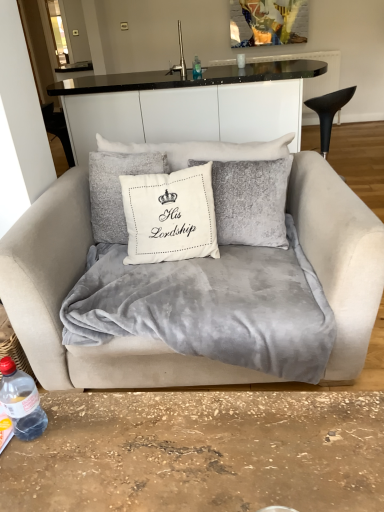
Where is `silver metallic faucet at upper center`? The image size is (384, 512). silver metallic faucet at upper center is located at coordinates tap(180, 58).

What do you see at coordinates (65, 295) in the screenshot? I see `velvet beige couch at center` at bounding box center [65, 295].

Locate an element on the screen. This screenshot has width=384, height=512. velvet beige couch at center is located at coordinates (65, 295).

Image resolution: width=384 pixels, height=512 pixels. What do you see at coordinates (241, 60) in the screenshot?
I see `white ceramic cup at upper center` at bounding box center [241, 60].

Identify the location of velvet gray blanket at center. (211, 306).

The image size is (384, 512). In order to click on transparent plastic bottle at lower left, the first bottle viewed from the left in this screenshot , I will do `click(21, 401)`.

In order to face transparent plastic bottle at lower left, the 2th bottle from the right, should I rotate leftwards or rightwards?

To face it directly, rotate left by 22.317 degrees.

Locate an element on the screen. This screenshot has width=384, height=512. transparent plastic bottle at center, arranged as the 1th bottle when viewed from the back is located at coordinates (197, 68).

Is velvet gray blanket at center facing towards white ceramic cup at upper center?

No, velvet gray blanket at center is not turned towards white ceramic cup at upper center.

Between velvet gray blanket at center and white ceramic cup at upper center, which one appears on the right side from the viewer's perspective?

Positioned to the right is white ceramic cup at upper center.

Would you say white ceramic cup at upper center is part of velvet gray blanket at center's contents?

No.

What's the angular difference between velvet gray blanket at center and white ceramic cup at upper center's facing directions?

The angle between the facing direction of velvet gray blanket at center and the facing direction of white ceramic cup at upper center is 174 degrees.

Can we say velvet gray blanket at center lies outside silver metallic faucet at upper center?

Yes, velvet gray blanket at center is located beyond the bounds of silver metallic faucet at upper center.

Is velvet gray blanket at center facing away from silver metallic faucet at upper center?

No.

Can you tell me how much velvet gray blanket at center and silver metallic faucet at upper center differ in facing direction?

176 degrees.

From the image's perspective, which one is positioned higher, white ceramic cup at upper center or transparent plastic bottle at lower left, the first bottle viewed from the left?

white ceramic cup at upper center.

Looking at this image, from a real-world perspective, is white ceramic cup at upper center physically below transparent plastic bottle at lower left, the 2th bottle from the back?

No.

Who is more distant, white ceramic cup at upper center or transparent plastic bottle at lower left, the first bottle viewed from the left?

white ceramic cup at upper center is behind.

Choose the correct answer: Is white ceramic cup at upper center inside transparent plastic bottle at lower left, which appears as the first bottle when viewed from the front, or outside it?

white ceramic cup at upper center lies outside transparent plastic bottle at lower left, which appears as the first bottle when viewed from the front.

How much distance is there between transparent plastic bottle at center, which ranks as the second bottle in front-to-back order, and velvet gray blanket at center?

A distance of 5.18 meters exists between transparent plastic bottle at center, which ranks as the second bottle in front-to-back order, and velvet gray blanket at center.

From the image's perspective, between transparent plastic bottle at center, which is the 1th bottle from top to bottom, and velvet gray blanket at center, who is located below?

velvet gray blanket at center, from the image's perspective.

Who is taller, transparent plastic bottle at center, arranged as the 1th bottle when viewed from the back, or velvet gray blanket at center?

velvet gray blanket at center is taller.

Considering the sizes of objects transparent plastic bottle at center, positioned as the 2th bottle in bottom-to-top order, and velvet gray blanket at center in the image provided, who is bigger, transparent plastic bottle at center, positioned as the 2th bottle in bottom-to-top order, or velvet gray blanket at center?

velvet gray blanket at center.

Is velvet beige couch at center taller or shorter than transparent plastic bottle at center, which ranks as the second bottle in front-to-back order?

In the image, velvet beige couch at center appears to be taller than transparent plastic bottle at center, which ranks as the second bottle in front-to-back order.

From a real-world perspective, which object stands above the other?

transparent plastic bottle at center, marked as the second bottle in a left-to-right arrangement, is physically above.

Considering their positions, is velvet beige couch at center located in front of or behind transparent plastic bottle at center, which is the 1th bottle from top to bottom?

velvet beige couch at center is in front of transparent plastic bottle at center, which is the 1th bottle from top to bottom.

Is transparent plastic bottle at center, which ranks as the second bottle in front-to-back order, bigger than velvet beige couch at center?

Incorrect, transparent plastic bottle at center, which ranks as the second bottle in front-to-back order, is not larger than velvet beige couch at center.

From the image's perspective, is transparent plastic bottle at center, marked as the second bottle in a left-to-right arrangement, under velvet beige couch at center?

No.

From a real-world perspective, is transparent plastic bottle at center, marked as the second bottle in a left-to-right arrangement, on velvet beige couch at center?

Yes, from a real-world perspective, transparent plastic bottle at center, marked as the second bottle in a left-to-right arrangement, is above velvet beige couch at center.

In the scene shown: Between transparent plastic bottle at center, positioned as the 1th bottle in right-to-left order, and velvet beige couch at center, which one has larger width?

With larger width is velvet beige couch at center.

Does velvet gray blanket at center turn towards transparent plastic bottle at center, positioned as the 1th bottle in right-to-left order?

No.

Which point is more forward, (239, 255) or (198, 63)?

The point (239, 255) is in front.

Considering the sizes of objects velvet gray blanket at center and transparent plastic bottle at center, positioned as the 1th bottle in right-to-left order, in the image provided, who is taller, velvet gray blanket at center or transparent plastic bottle at center, positioned as the 1th bottle in right-to-left order,?

Standing taller between the two is velvet gray blanket at center.

Image resolution: width=384 pixels, height=512 pixels. What are the coordinates of `blanket in front of the white ceramic cup at upper center` in the screenshot? It's located at (211, 306).

You are a GUI agent. You are given a task and a screenshot of the screen. Output one action in this format:
    pyautogui.click(x=<x>, y=<y>)
    Task: Click on the faucet above the velvet gray blanket at center (from the image's perspective)
    
    Given the screenshot: What is the action you would take?
    pyautogui.click(x=180, y=58)

From the image, which object appears to be farther from velvet gray blanket at center, velvet beige couch at center or silver metallic faucet at upper center?

Based on the image, silver metallic faucet at upper center appears to be further to velvet gray blanket at center.

Estimate the real-world distances between objects in this image. Which object is further from silver metallic faucet at upper center, white ceramic cup at upper center or velvet gray blanket at center?

Among the two, velvet gray blanket at center is located further to silver metallic faucet at upper center.

From the picture: When comparing their distances from velvet beige couch at center, does transparent plastic bottle at lower left, positioned as the 1th bottle in bottom-to-top order, or velvet gray blanket at center seem further?

transparent plastic bottle at lower left, positioned as the 1th bottle in bottom-to-top order, is further to velvet beige couch at center.

Estimate the real-world distances between objects in this image. Which object is closer to transparent plastic bottle at center, positioned as the 2th bottle in bottom-to-top order, white ceramic cup at upper center or transparent plastic bottle at lower left, the 2th bottle from the back?

Based on the image, white ceramic cup at upper center appears to be nearer to transparent plastic bottle at center, positioned as the 2th bottle in bottom-to-top order.

Looking at the image, which one is located closer to velvet beige couch at center, white ceramic cup at upper center or velvet gray blanket at center?

Among the two, velvet gray blanket at center is located nearer to velvet beige couch at center.

Considering their positions, is white ceramic cup at upper center positioned closer to transparent plastic bottle at center, positioned as the 1th bottle in right-to-left order, than velvet gray blanket at center?

white ceramic cup at upper center is closer to transparent plastic bottle at center, positioned as the 1th bottle in right-to-left order.

From the image, which object appears to be nearer to white ceramic cup at upper center, silver metallic faucet at upper center or velvet beige couch at center?

silver metallic faucet at upper center lies closer to white ceramic cup at upper center than the other object.

Consider the image. Estimate the real-world distances between objects in this image. Which object is closer to transparent plastic bottle at center, which is the 1th bottle from top to bottom, transparent plastic bottle at lower left, which appears as the first bottle when viewed from the front, or velvet gray blanket at center?

velvet gray blanket at center is closer to transparent plastic bottle at center, which is the 1th bottle from top to bottom.

At what (x,y) coordinates should I click in order to perform the action: click on faucet positioned between transparent plastic bottle at lower left, which appears as the first bottle when viewed from the front, and transparent plastic bottle at center, positioned as the 1th bottle in right-to-left order, from near to far. Please return your answer as a coordinate pair (x, y). Looking at the image, I should click on (180, 58).

This screenshot has width=384, height=512. I want to click on blanket positioned between velvet beige couch at center and silver metallic faucet at upper center from near to far, so click(211, 306).

Locate an element on the screen. bottle situated between silver metallic faucet at upper center and white ceramic cup at upper center from left to right is located at coordinates (x=197, y=68).

This screenshot has height=512, width=384. Identify the location of faucet between velvet beige couch at center and transparent plastic bottle at center, which ranks as the second bottle in front-to-back order, along the z-axis. (180, 58).